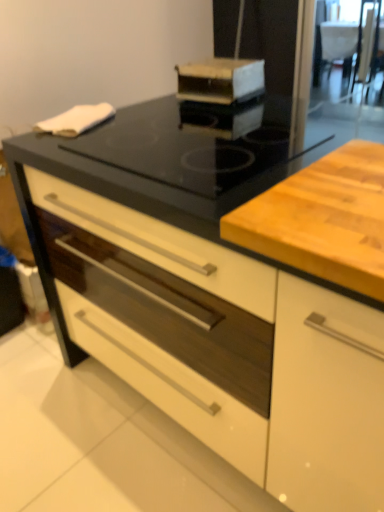
Question: Does transparent glass screen door at upper right have a lesser height compared to wooden cutting board at center?

Choices:
 (A) no
 (B) yes

Answer: (A)

Question: From the image's perspective, would you say transparent glass screen door at upper right is positioned over wooden cutting board at center?

Choices:
 (A) no
 (B) yes

Answer: (B)

Question: Can you confirm if transparent glass screen door at upper right is smaller than wooden cutting board at center?

Choices:
 (A) no
 (B) yes

Answer: (A)

Question: Does transparent glass screen door at upper right come behind wooden cutting board at center?

Choices:
 (A) no
 (B) yes

Answer: (B)

Question: Is wooden cutting board at center a part of transparent glass screen door at upper right?

Choices:
 (A) yes
 (B) no

Answer: (B)

Question: From their relative heights in the image, would you say wooden box at upper center is taller or shorter than transparent glass screen door at upper right?

Choices:
 (A) short
 (B) tall

Answer: (A)

Question: Considering the positions of wooden box at upper center and transparent glass screen door at upper right in the image, is wooden box at upper center bigger or smaller than transparent glass screen door at upper right?

Choices:
 (A) small
 (B) big

Answer: (A)

Question: Is wooden box at upper center inside or outside of transparent glass screen door at upper right?

Choices:
 (A) outside
 (B) inside

Answer: (A)

Question: From a real-world perspective, is wooden box at upper center above or below transparent glass screen door at upper right?

Choices:
 (A) above
 (B) below

Answer: (A)

Question: Considering the positions of transparent glass screen door at upper right and black glass gas stove at center in the image, is transparent glass screen door at upper right bigger or smaller than black glass gas stove at center?

Choices:
 (A) big
 (B) small

Answer: (A)

Question: From the image's perspective, is transparent glass screen door at upper right located above or below black glass gas stove at center?

Choices:
 (A) above
 (B) below

Answer: (A)

Question: From a real-world perspective, is transparent glass screen door at upper right positioned above or below black glass gas stove at center?

Choices:
 (A) above
 (B) below

Answer: (B)

Question: From their relative heights in the image, would you say transparent glass screen door at upper right is taller or shorter than black glass gas stove at center?

Choices:
 (A) tall
 (B) short

Answer: (A)

Question: Is wooden cutting board at center to the left or to the right of black glass gas stove at center in the image?

Choices:
 (A) left
 (B) right

Answer: (B)

Question: From a real-world perspective, is wooden cutting board at center above or below black glass gas stove at center?

Choices:
 (A) below
 (B) above

Answer: (B)